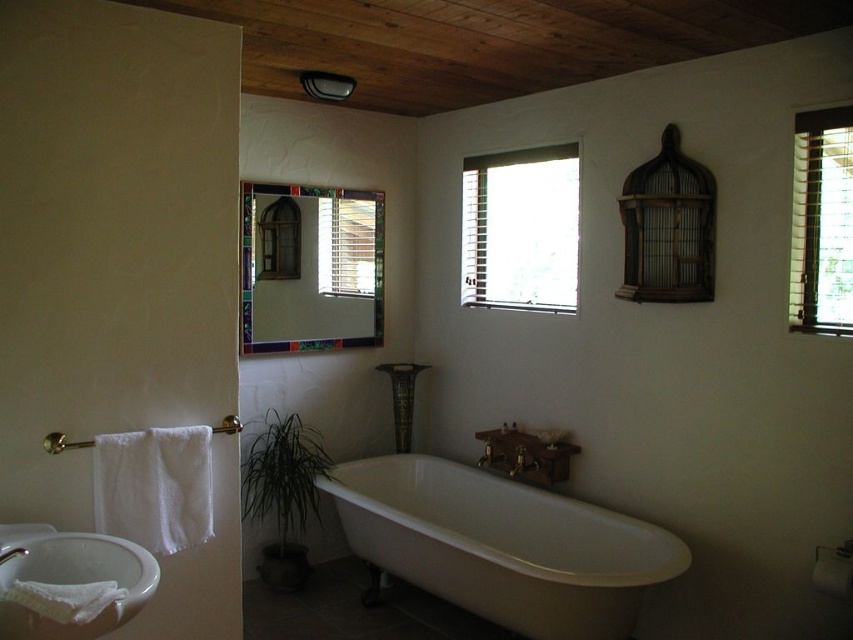
Question: Among these points, which one is nearest to the camera?

Choices:
 (A) (93, 536)
 (B) (287, 484)
 (C) (651, 550)

Answer: (A)

Question: Based on their relative distances, which object is nearer to the white ceramic sink at lower left?

Choices:
 (A) white glossy bathtub at center
 (B) transparent glass window at upper center
 (C) green leafy plant at lower left
 (D) matte glass window at upper left

Answer: (A)

Question: Observing the image, what is the correct spatial positioning of white glossy bathtub at center in reference to wooden blinds at upper right?

Choices:
 (A) left
 (B) right

Answer: (A)

Question: Observing the image, what is the correct spatial positioning of white glossy bathtub at center in reference to green leafy plant at lower left?

Choices:
 (A) above
 (B) below

Answer: (B)

Question: Which of the following is the closest to the observer?

Choices:
 (A) white ceramic sink at lower left
 (B) wooden blinds at upper right
 (C) white glossy bathtub at center
 (D) matte glass window at upper left

Answer: (A)

Question: Is white ceramic sink at lower left in front of green leafy plant at lower left?

Choices:
 (A) no
 (B) yes

Answer: (B)